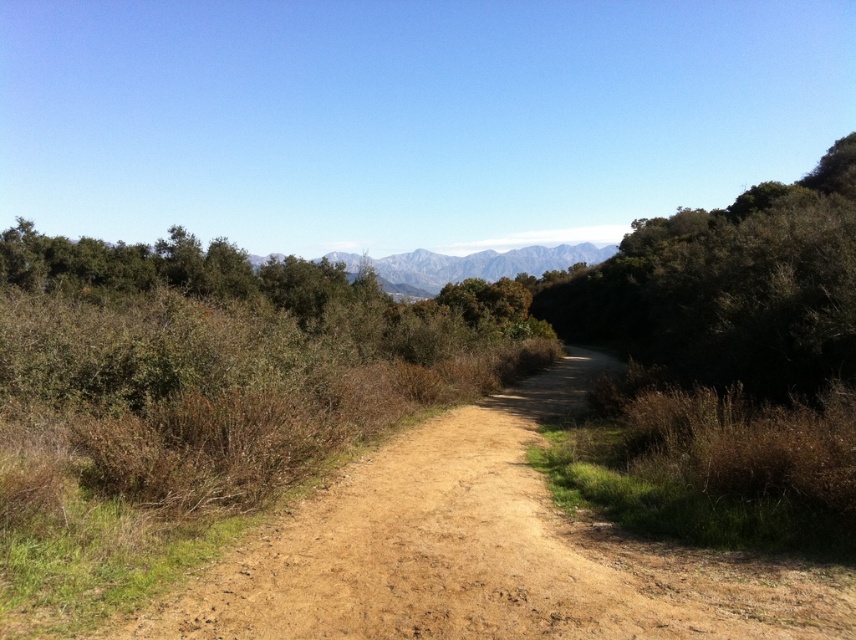
You are a hiker planning to walk along the dried dirt path at center towards the gray rocky mountains at center. Based on the scene, will the path lead you directly to the mountains?

The dried dirt path at center is in front of gray rocky mountains at center, so the path is positioned between the observer and the mountains. This suggests that the path leads towards the mountains, as it extends into the distance in their direction.

You are standing at the starting point of the dirt path and want to reach the mountain range in the background. Which point, point [620,532] or point [470,259], is closer to you as you begin your journey?

Point [620,532] is closer to the viewer than point [470,259], so it is the closer point as you begin your journey.